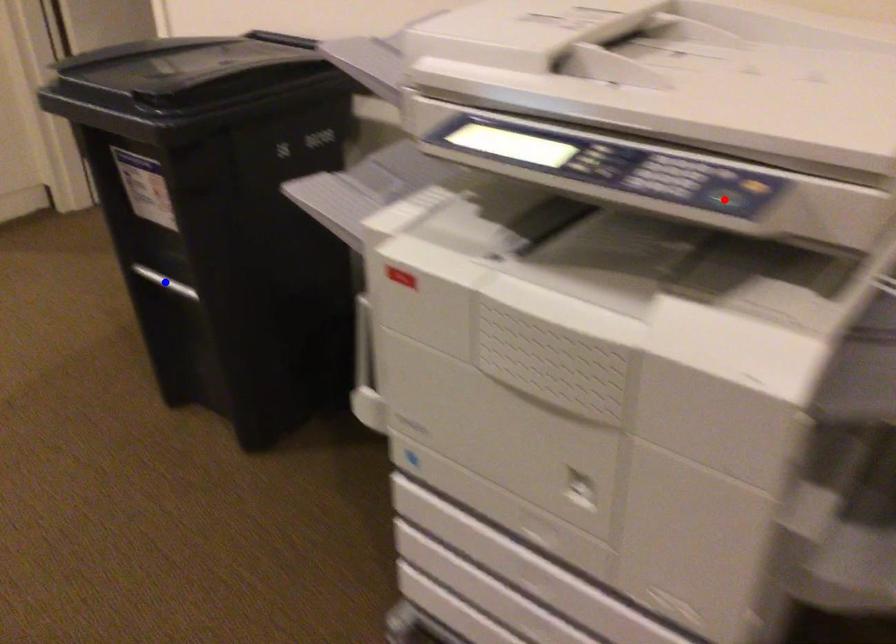
Question: Two points are marked on the image. Which point is closer to the camera?

Choices:
 (A) Blue point is closer.
 (B) Red point is closer.

Answer: (B)